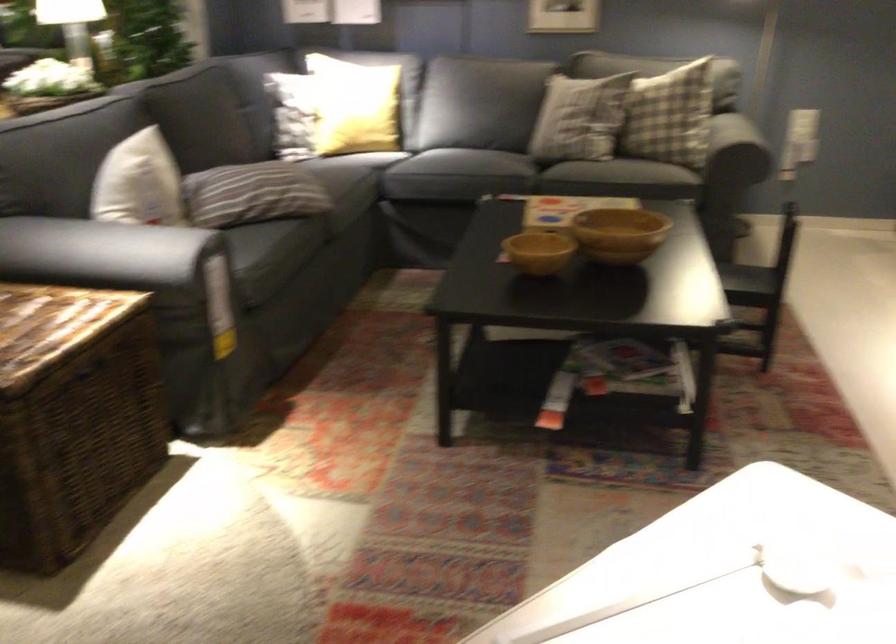
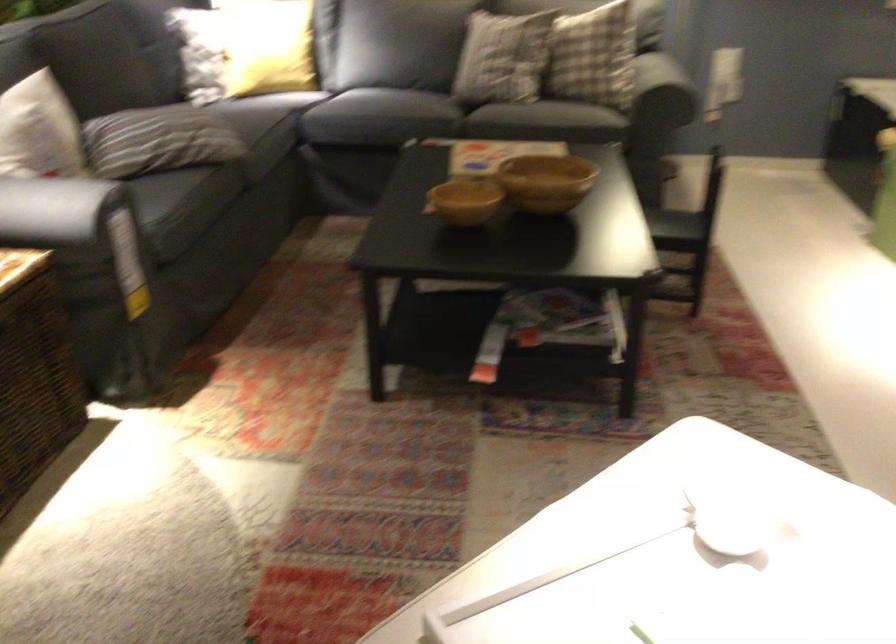
Question: What movement of the cameraman would produce the second image?

Choices:
 (A) Left
 (B) Right
 (C) Forward
 (D) Backward

Answer: (C)